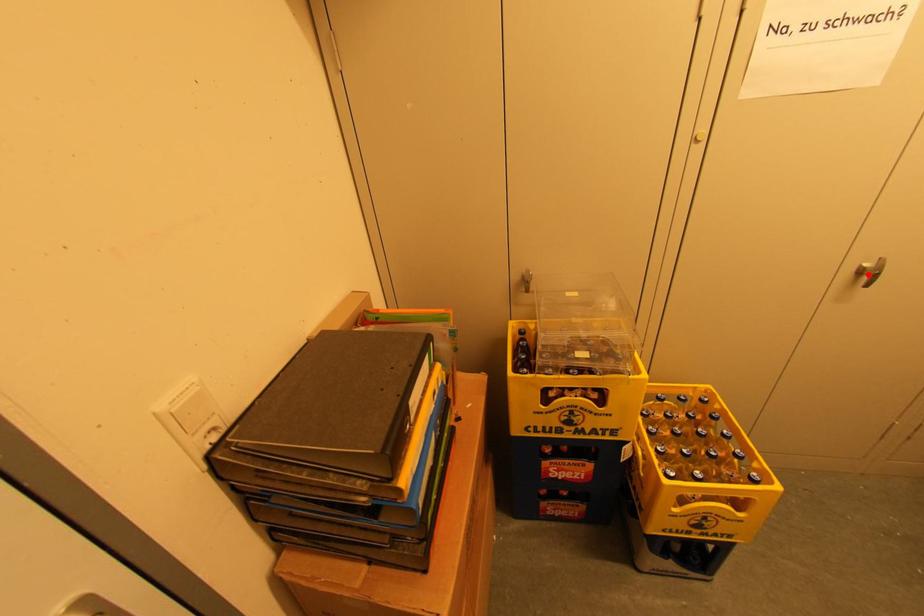
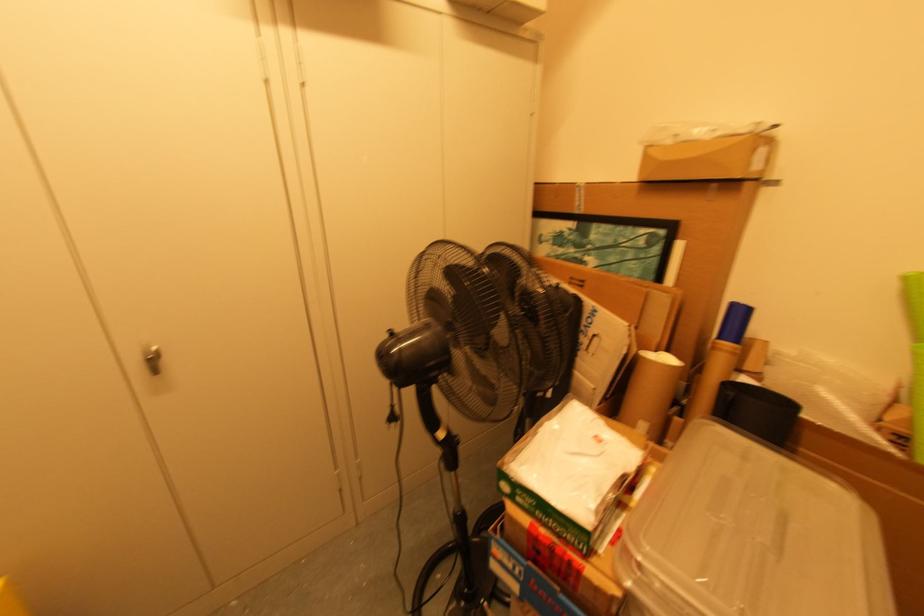
In the second image, find the point that corresponds to the highlighted location in the first image.

(152, 361)